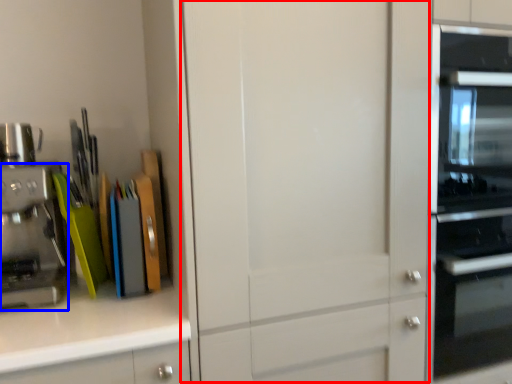
Question: Which of the following is the closest to the observer, glass door (highlighted by a red box) or kitchen appliance (highlighted by a blue box)?

Choices:
 (A) glass door
 (B) kitchen appliance

Answer: (A)